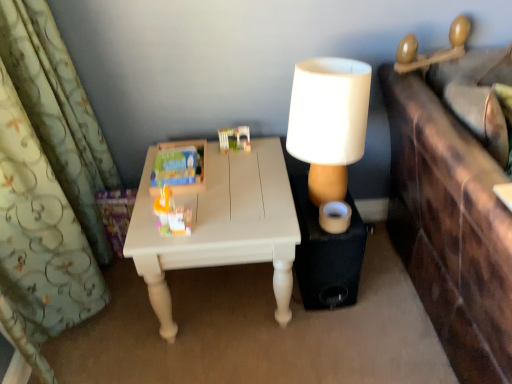
The width and height of the screenshot is (512, 384). I want to click on free point below matte plastic toy at center, positioned as the 1th toy in left-to-right order (from a real-world perspective), so click(182, 173).